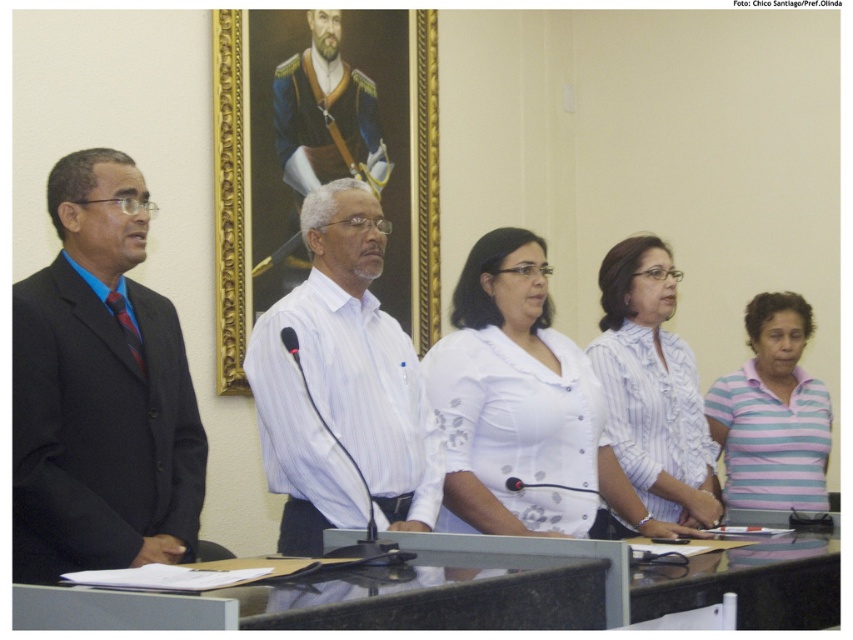
Question: Among these objects, which one is nearest to the camera?

Choices:
 (A) gold framed portrait at center
 (B) striped cotton shirt at lower right

Answer: (B)

Question: Does white striped shirt at center have a greater width compared to striped cotton shirt at lower right?

Choices:
 (A) yes
 (B) no

Answer: (A)

Question: In this image, where is matte black suit at left located relative to white striped shirt at center?

Choices:
 (A) above
 (B) below

Answer: (A)

Question: Can you confirm if gold framed portrait at center is positioned to the right of striped cotton shirt at lower right?

Choices:
 (A) no
 (B) yes

Answer: (A)

Question: Which point appears farthest from the camera in this image?

Choices:
 (A) (62, 465)
 (B) (659, 252)
 (C) (329, 248)
 (D) (476, 499)

Answer: (B)

Question: Which of these objects is positioned farthest from the white fabric blouse at center?

Choices:
 (A) matte black suit at left
 (B) gold framed portrait at center
 (C) white striped shirt at center

Answer: (B)